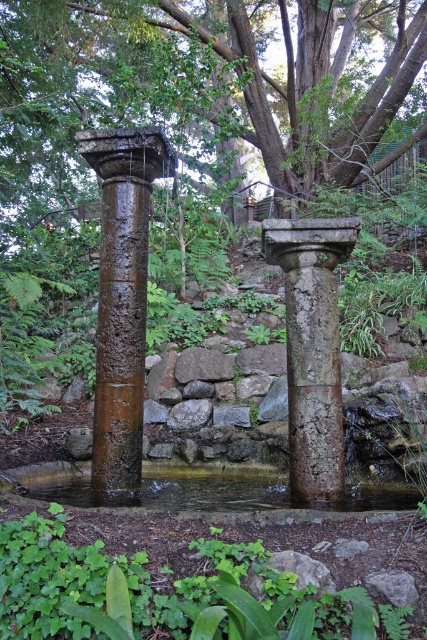
You are a landscape architect designing a pathway around the rusty stone column at center and the clear water at center. Since the column is over the water, will the pathway need to go around the column first before reaching the water?

The rusty stone column at center is positioned over clear water at center, so the pathway would need to go around the column first before reaching the water because the column is directly above the water area.

You are a gardener who wants to plant a new shrub in the scene. You have a small shrub that needs 2 meters of space. The green leafy plant at lower center and the clear water at center are in the area. Can you plant the shrub between them?

The green leafy plant at lower center has a lesser width compared to clear water at center. Since the shrub requires 2 meters of space, you need to check the distance between them. However, the description only provides information about their widths, not the distance between them. Therefore, it is unclear if there is enough space to plant the shrub between them.

You are standing at the edge of the pool and want to reach the point marked as point (333, 225). However, there is an obstacle at point (216, 509). Can you walk directly to your destination without going around the obstacle?

Since point (333, 225) is behind point (216, 509), you cannot walk directly to your destination without going around the obstacle at point (216, 509).